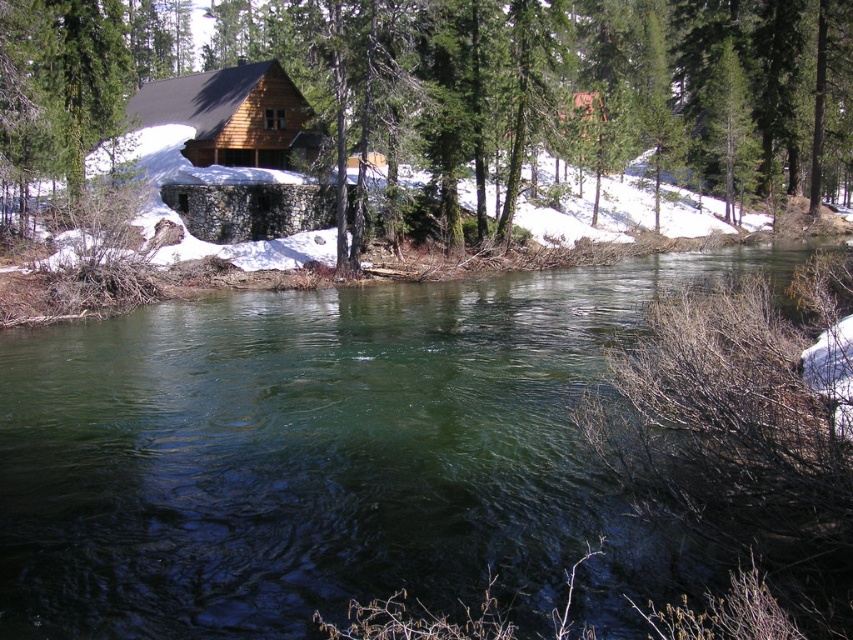
You are planning to build a small wooden dock for fishing. The dock needs to be as large as the matte wood cabin at center. Can the green translucent water at center accommodate the dock in terms of size?

The green translucent water at center has a smaller size compared to the matte wood cabin at center. Therefore, the dock cannot be accommodated in the green translucent water at center because it is smaller than the required size.

You are standing at the edge of the green translucent water at center and want to reach the matte wood cabin at center. Which direction should you walk to get closer to the cabin?

The matte wood cabin at center is taller than the green translucent water at center, so you should walk towards the cabin as it is elevated relative to the water.